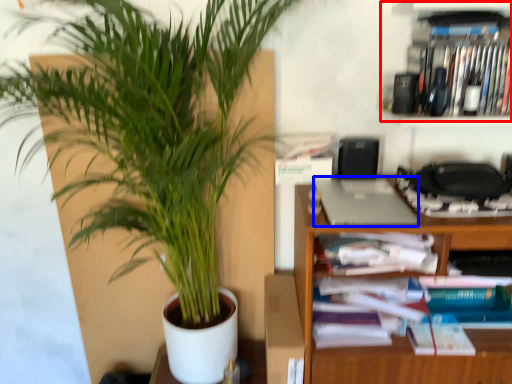
Question: Which object is closer to the camera taking this photo, cabinet (highlighted by a red box) or laptop (highlighted by a blue box)?

Choices:
 (A) cabinet
 (B) laptop

Answer: (B)